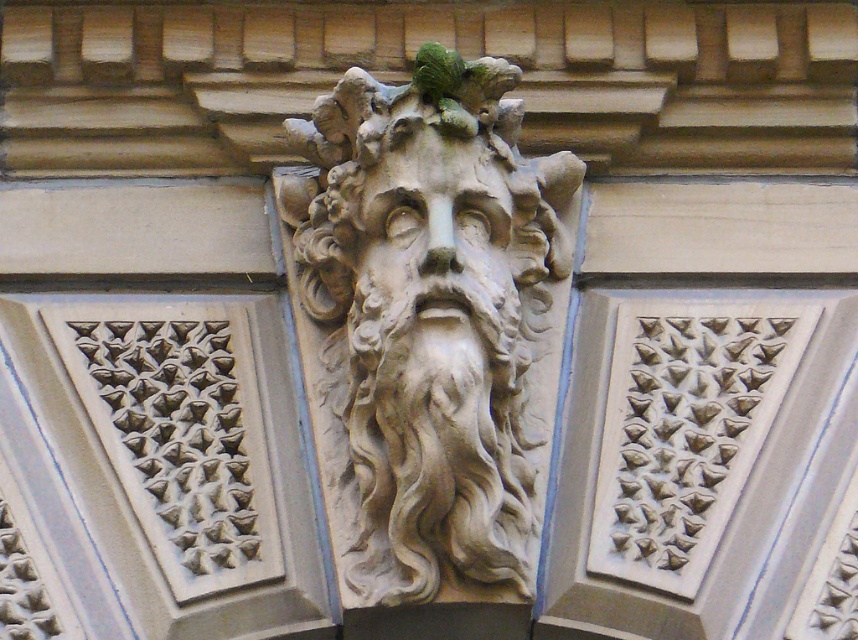
You are an architect analyzing the sculpture and its design elements. Which object, the stone sculpture at center or the stone textured face at center, would you consider the primary focal point due to its size?

The stone sculpture at center is larger in size than the stone textured face at center, making it the primary focal point.

You are an architect examining the stone sculpture at center and the stone textured face at center in the image. Which of these two elements is positioned higher in the composition?

The stone sculpture at center is positioned higher than the stone textured face at center.